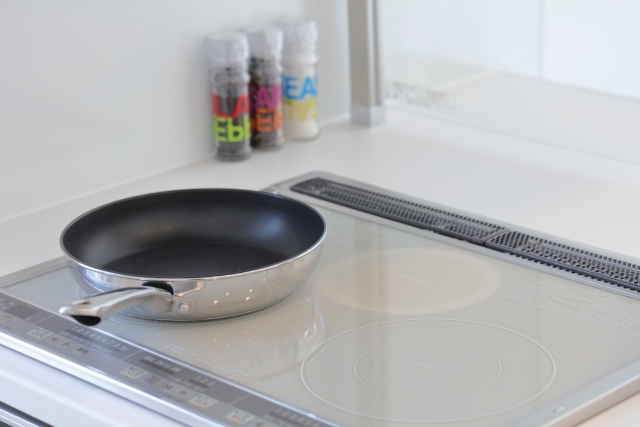
Locate an element on the screen. wall is located at coordinates (114, 81).